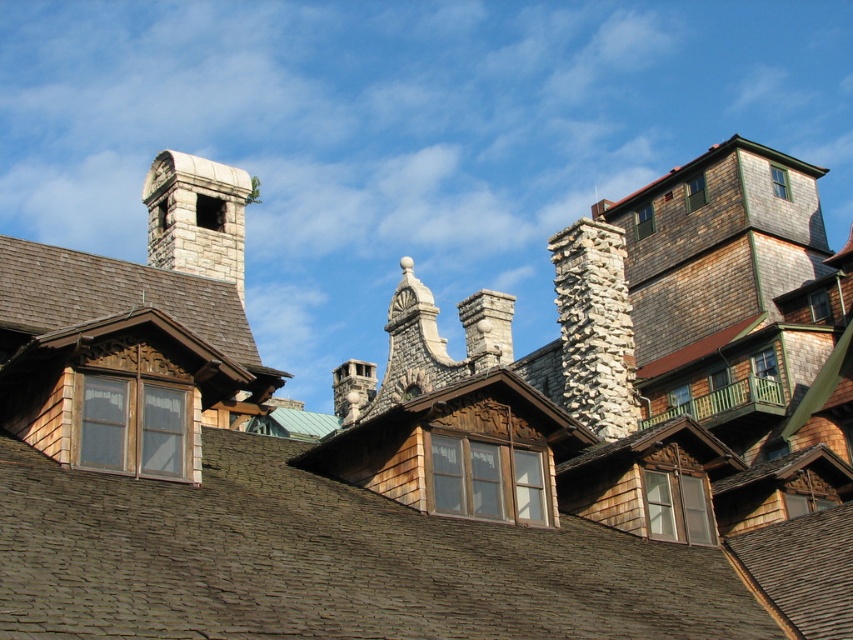
You are standing in front of the building and notice two points marked on the roof. The first point is at coordinates point (x=563, y=381) and the second is at point (x=177, y=196). Which point is closer to you?

Point (x=177, y=196) is closer to you because it is not as far as point (x=563, y=381) which is further away based on their positions.